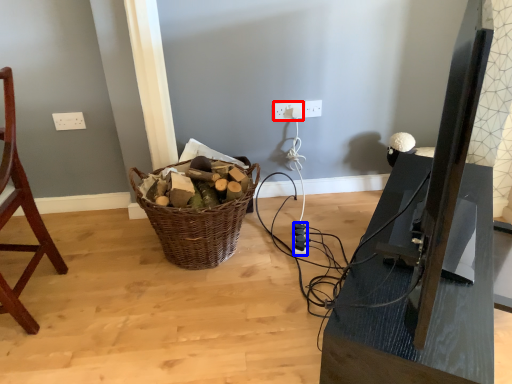
Question: Which object is further to the camera taking this photo, electric outlet (highlighted by a red box) or extension cord (highlighted by a blue box)?

Choices:
 (A) electric outlet
 (B) extension cord

Answer: (A)